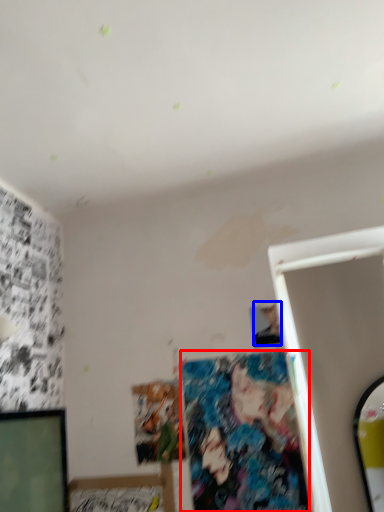
Question: Which object is further to the camera taking this photo, art (highlighted by a red box) or person (highlighted by a blue box)?

Choices:
 (A) art
 (B) person

Answer: (B)